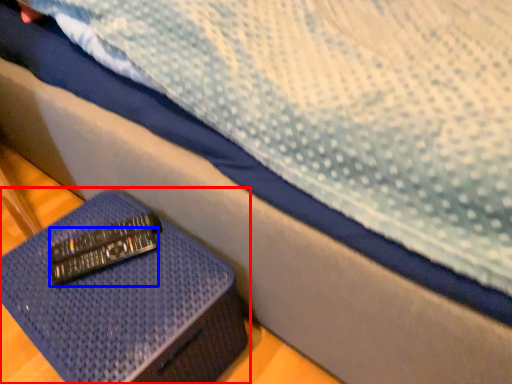
Question: Which point is further to the camera, furniture (highlighted by a red box) or remote (highlighted by a blue box)?

Choices:
 (A) furniture
 (B) remote

Answer: (B)